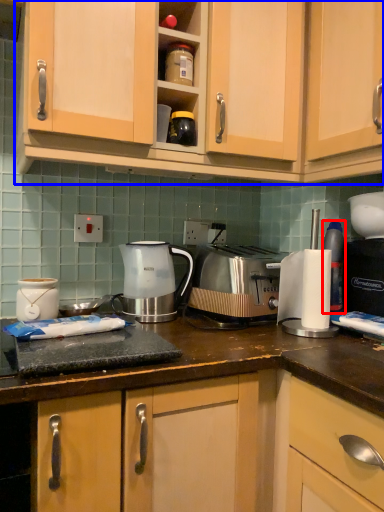
Question: Which object is closer to the camera taking this photo, bottle (highlighted by a red box) or cabinetry (highlighted by a blue box)?

Choices:
 (A) bottle
 (B) cabinetry

Answer: (B)